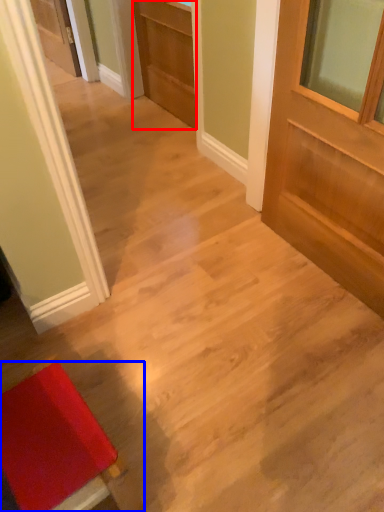
Question: Among these objects, which one is nearest to the camera, door (highlighted by a red box) or furniture (highlighted by a blue box)?

Choices:
 (A) door
 (B) furniture

Answer: (B)